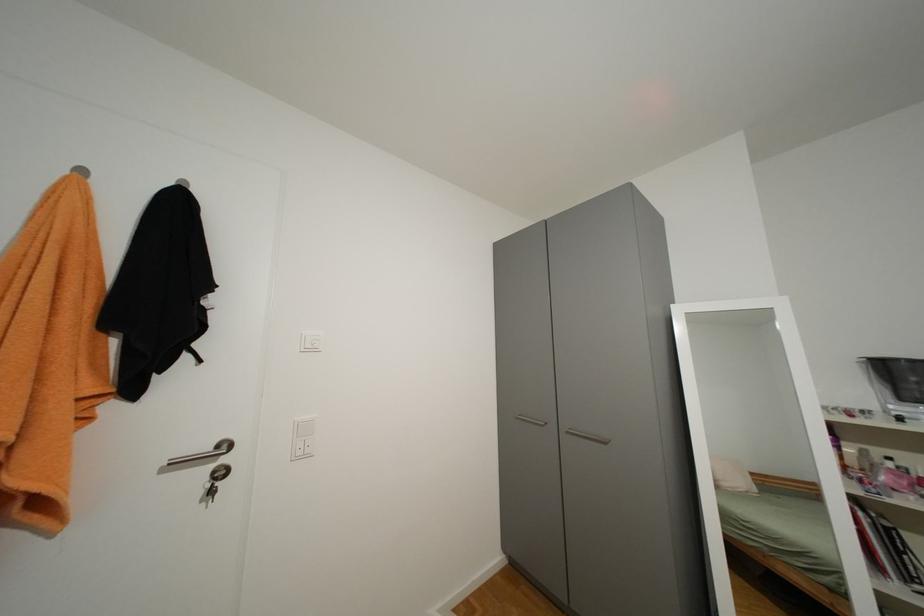
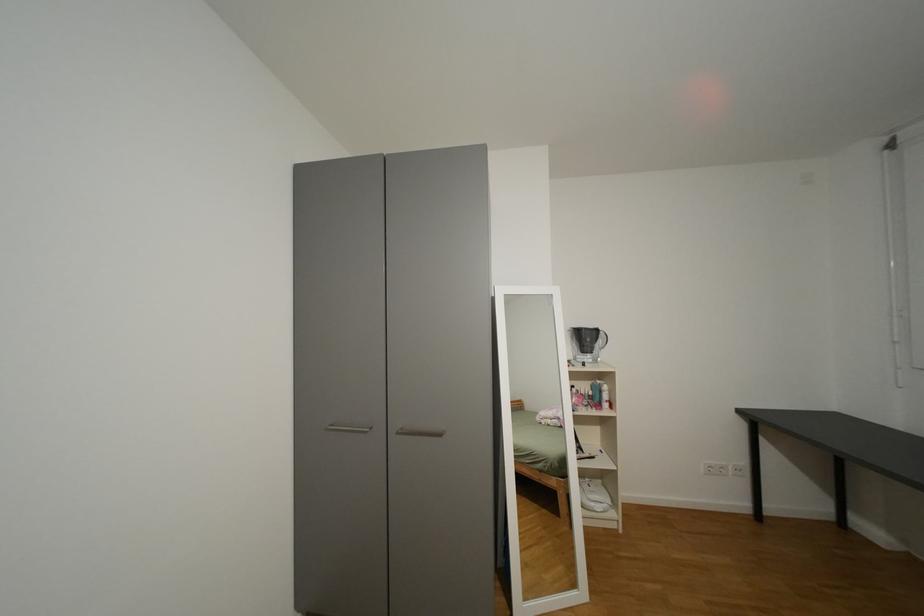
Question: The camera is either moving clockwise (left) or counter-clockwise (right) around the object. The first image is from the beginning of the video and the second image is from the end. Is the camera moving left or right when shooting the video?

Choices:
 (A) Left
 (B) Right

Answer: (A)